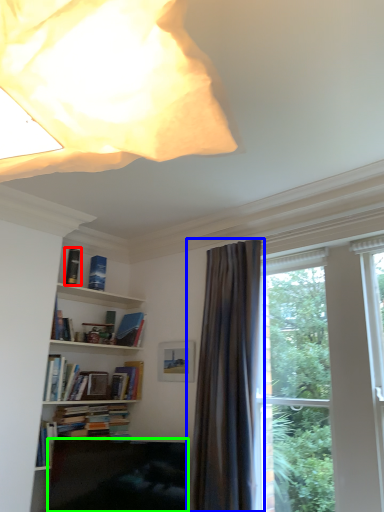
Question: Which is nearer to the book (highlighted by a red box)? curtain (highlighted by a blue box) or furniture (highlighted by a green box).

Choices:
 (A) curtain
 (B) furniture

Answer: (B)